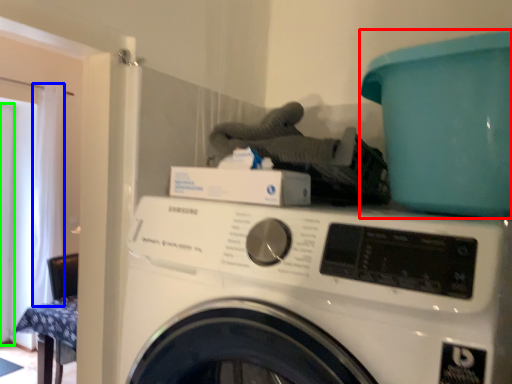
Question: Estimate the real-world distances between objects in this image. Which object is closer to teal (highlighted by a red box), curtain (highlighted by a blue box) or screen door (highlighted by a green box)?

Choices:
 (A) curtain
 (B) screen door

Answer: (A)